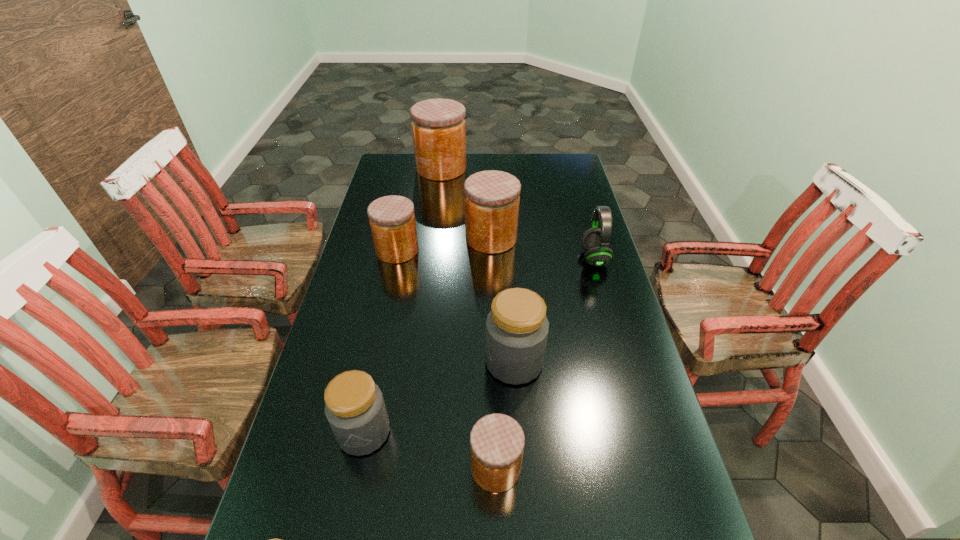
Find the location of a particular element. vacant area between the second farthest gray jar and the tallest object is located at coordinates (402, 300).

Locate an element on the screen. free space between the second farthest gray jar and the second smallest orange jar is located at coordinates (380, 341).

Where is `vacant area that lies between the second nearest gray jar and the fifth farthest object`? The height and width of the screenshot is (540, 960). vacant area that lies between the second nearest gray jar and the fifth farthest object is located at coordinates (439, 397).

At what (x,y) coordinates should I click in order to perform the action: click on empty space between the farthest jar and the rightmost gray jar. Please return your answer as a coordinate pair (x, y). This screenshot has height=540, width=960. Looking at the image, I should click on (478, 265).

Identify the location of the fourth closest object relative to the headset. This screenshot has height=540, width=960. (438, 126).

Point out which object is positioned as the seventh nearest to the smallest gray jar. Please provide its 2D coordinates. Your answer should be formatted as a tuple, i.e. [(x, y)], where the tuple contains the x and y coordinates of a point satisfying the conditions above.

[(438, 126)]

Identify which jar is the fifth nearest to the third biggest orange jar. Please provide its 2D coordinates. Your answer should be formatted as a tuple, i.e. [(x, y)], where the tuple contains the x and y coordinates of a point satisfying the conditions above.

[(497, 441)]

Choose which jar is the nearest neighbor to the farthest jar. Please provide its 2D coordinates. Your answer should be formatted as a tuple, i.e. [(x, y)], where the tuple contains the x and y coordinates of a point satisfying the conditions above.

[(492, 198)]

Locate which orange jar ranks in proximity to the third biggest orange jar. Please provide its 2D coordinates. Your answer should be formatted as a tuple, i.e. [(x, y)], where the tuple contains the x and y coordinates of a point satisfying the conditions above.

[(492, 198)]

Find the location of a particular element. orange jar object that ranks as the third closest to the rightmost gray jar is located at coordinates (392, 220).